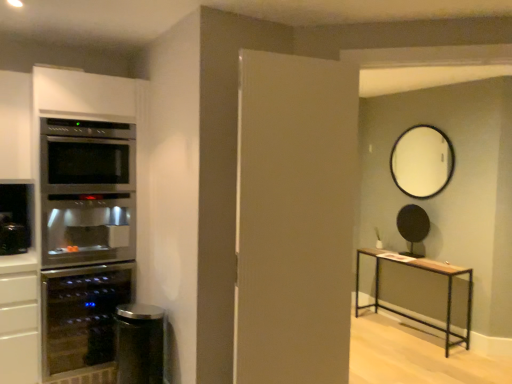
Question: Which is correct: matte glass wine cooler at left, acting as the 2th appliance starting from the back, is inside stainless steel fridge at left, or outside of it?

Choices:
 (A) outside
 (B) inside

Answer: (B)

Question: Would you say matte glass wine cooler at left, the second appliance from the front, is to the left or to the right of stainless steel fridge at left in the picture?

Choices:
 (A) right
 (B) left

Answer: (B)

Question: Which object is the closest to the light brown wood table at right?

Choices:
 (A) stainless steel fridge at left
 (B) satin black trash can at lower left, the third appliance in the back-to-front sequence
 (C) black matte round mirror at upper center, acting as the 3th appliance starting from the front
 (D) white matte door at center
 (E) matte glass wine cooler at left, acting as the 2th appliance starting from the back

Answer: (C)

Question: Which is farther from the white matte door at center?

Choices:
 (A) light brown wood table at right
 (B) matte glass wine cooler at left, the second appliance from the front
 (C) white glossy mirror at upper center
 (D) black matte round mirror at upper center, which appears as the third appliance when viewed from the left
 (E) satin black trash can at lower left, which appears as the first appliance when viewed from the front

Answer: (D)